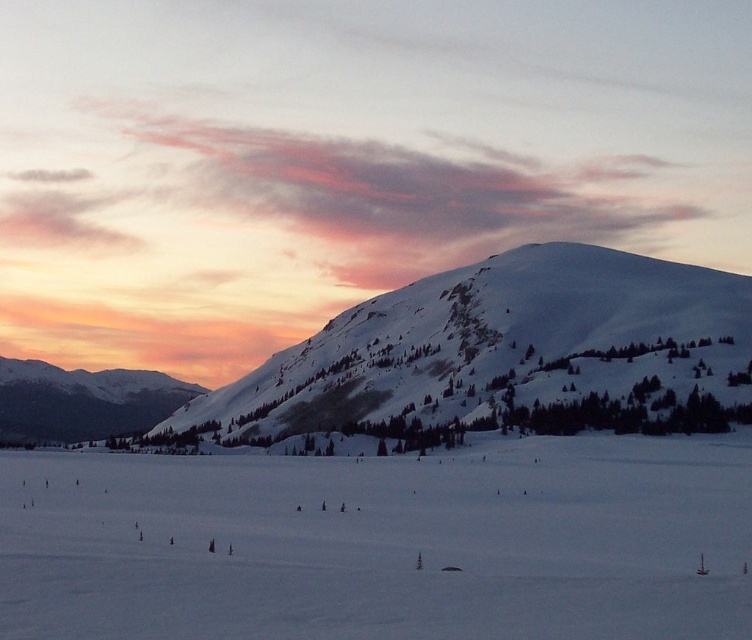
Based on the photo, you are standing in the winter landscape and want to walk from the point closer to you to the point further away. Which path would you take between the two points, point (526, 316) and point (58, 378)?

You should walk from point (526, 316) to point (58, 378) because point (526, 316) is closer to the viewer and the other is further away.